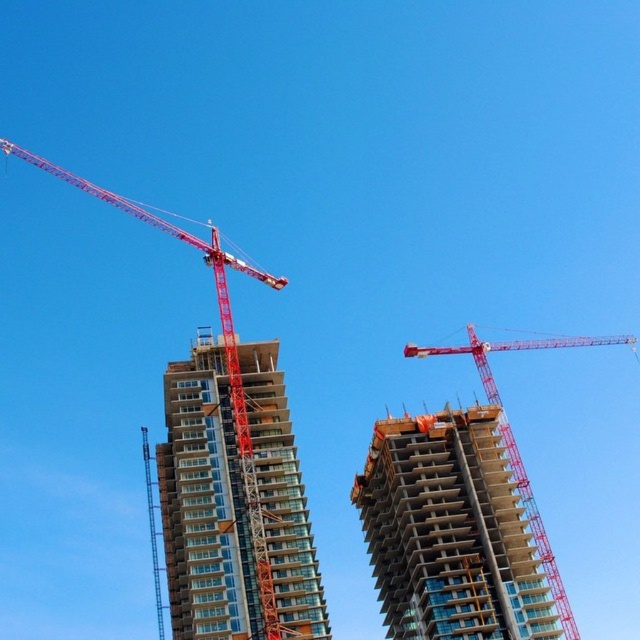
Question: Which of the following is the closest to the observer?

Choices:
 (A) (225, 483)
 (B) (241, 390)
 (C) (516, 515)

Answer: (A)

Question: Does glassy concrete building at center appear on the left side of concrete building at center?

Choices:
 (A) no
 (B) yes

Answer: (B)

Question: Does glassy concrete building at center appear over red metal crane at upper left?

Choices:
 (A) no
 (B) yes

Answer: (A)

Question: Among these objects, which one is farthest from the camera?

Choices:
 (A) red metal crane at upper left
 (B) concrete building at center

Answer: (B)

Question: Which point is farther to the camera?

Choices:
 (A) red metal crane at upper left
 (B) concrete building at center

Answer: (B)

Question: Is glassy concrete building at center below red metal crane at upper left?

Choices:
 (A) no
 (B) yes

Answer: (B)